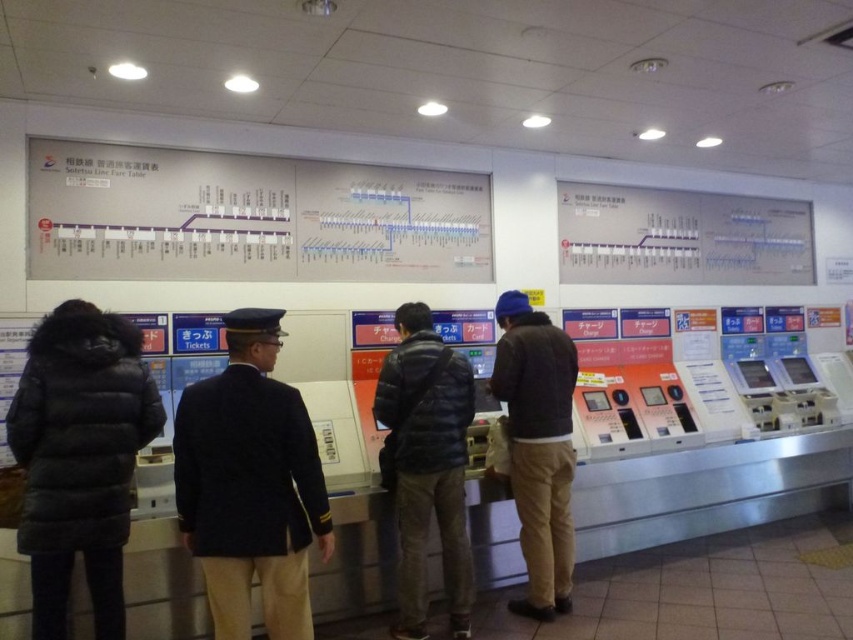
Between dark blue puffer jacket at center and dark gray sweater at center, which one is positioned lower?

dark blue puffer jacket at center is below.

Which is behind, point (399, 484) or point (509, 436)?

Positioned behind is point (509, 436).

Is point (398, 522) more distant than point (544, 445)?

No, (398, 522) is closer to viewer.

The width and height of the screenshot is (853, 640). I want to click on dark blue puffer jacket at center, so pos(427,465).

Which is more to the left, dark blue uniform at center or dark blue puffer jacket at center?

Positioned to the left is dark blue uniform at center.

Who is higher up, dark blue uniform at center or dark blue puffer jacket at center?

Result: Positioned higher is dark blue uniform at center.

At what (x,y) coordinates should I click in order to perform the action: click on dark blue uniform at center. Please return your answer as a coordinate pair (x, y). This screenshot has width=853, height=640. Looking at the image, I should click on (250, 483).

Which is more to the left, black fur-trimmed coat at left or dark gray sweater at center?

black fur-trimmed coat at left is more to the left.

Where is `black fur-trimmed coat at left`? black fur-trimmed coat at left is located at coordinates (79, 458).

Which is behind, point (67, 406) or point (543, 502)?

Point (543, 502)

Find the location of `black fur-trimmed coat at left`. black fur-trimmed coat at left is located at coordinates (79, 458).